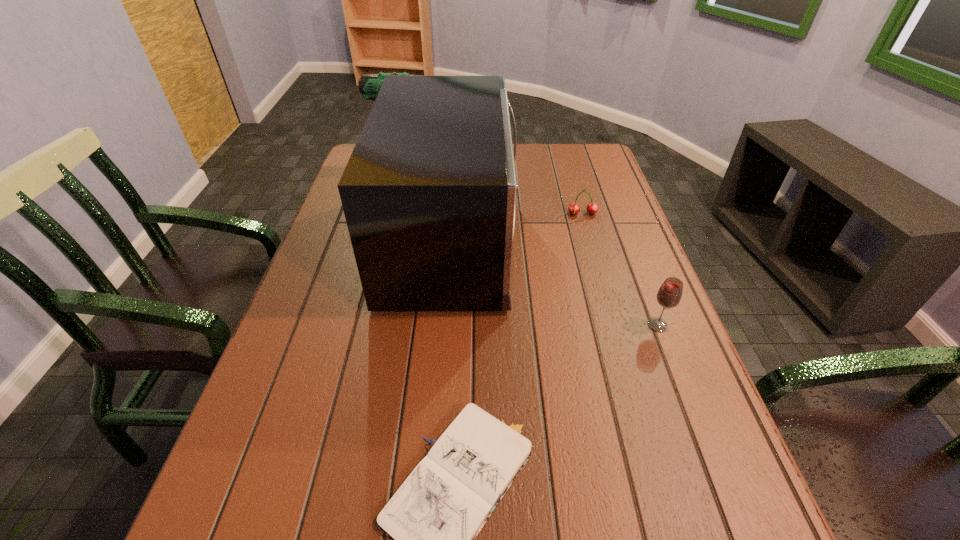
The width and height of the screenshot is (960, 540). Identify the location of free space in the image that satisfies the following two spatial constraints: 1. on the back side of the glass drink container; 2. with the door open on the microwave oven. (624, 239).